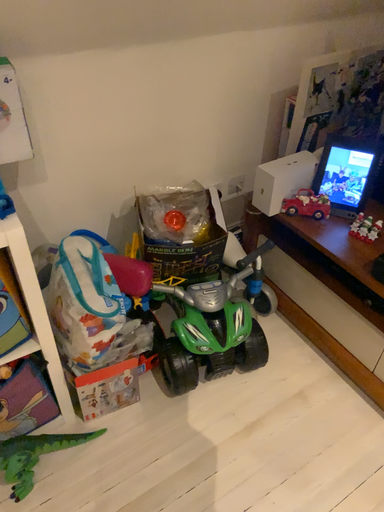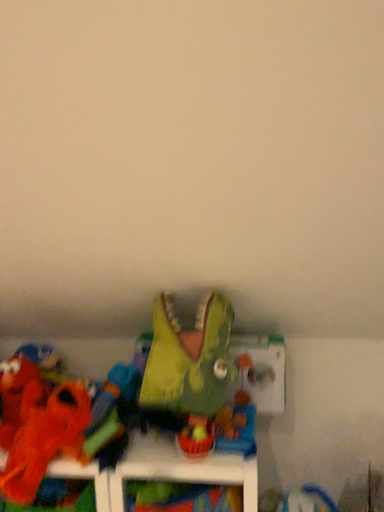
Question: Which way did the camera rotate in the video?

Choices:
 (A) rotated right
 (B) rotated left

Answer: (B)